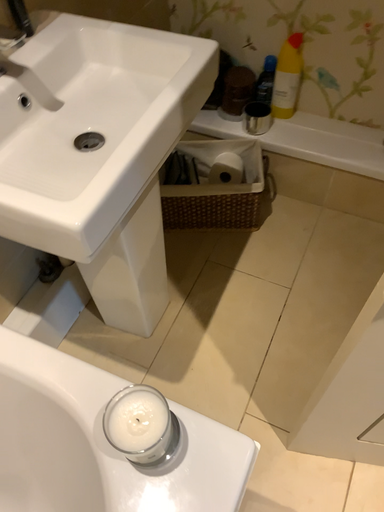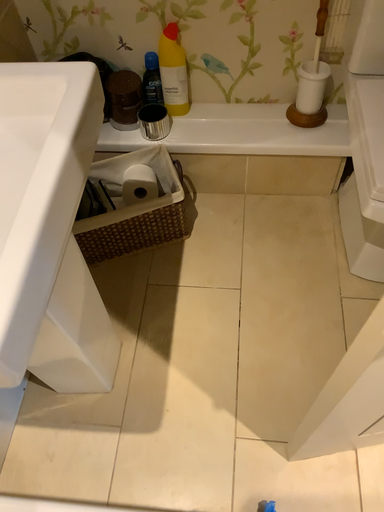
Question: Which way did the camera rotate in the video?

Choices:
 (A) rotated right
 (B) rotated left

Answer: (A)